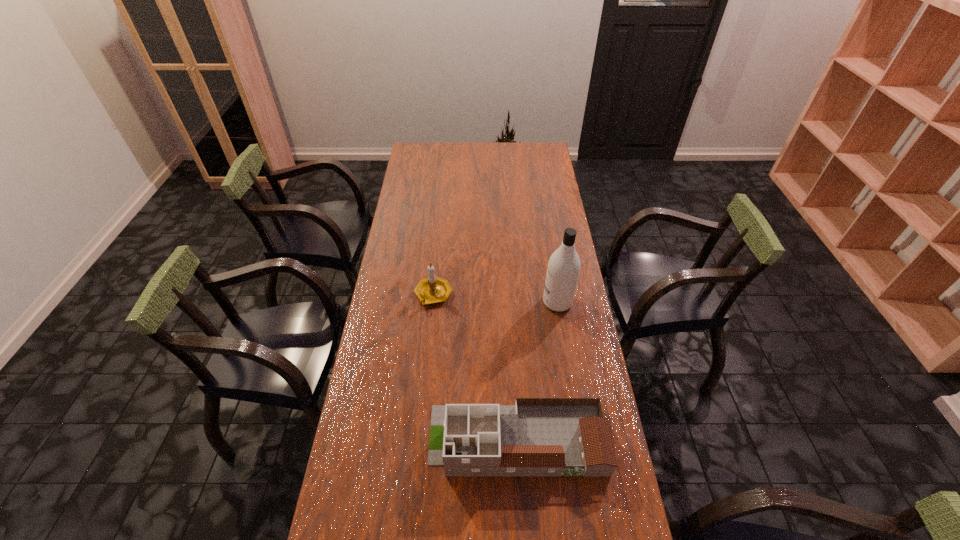
In order to click on object that is at the left edge in this screenshot , I will do `click(431, 290)`.

The height and width of the screenshot is (540, 960). I want to click on shampoo that is at the right edge, so click(563, 269).

Where is `dollhouse that is positioned at the right edge`? The width and height of the screenshot is (960, 540). dollhouse that is positioned at the right edge is located at coordinates (537, 436).

Image resolution: width=960 pixels, height=540 pixels. I want to click on blank area at the left edge, so click(x=393, y=289).

Image resolution: width=960 pixels, height=540 pixels. Find the location of `vacant area at the right edge`. vacant area at the right edge is located at coordinates (602, 406).

Image resolution: width=960 pixels, height=540 pixels. Find the location of `free space at the far left corner`. free space at the far left corner is located at coordinates (410, 158).

Where is `vacant space at the far right corner of the desktop`? The width and height of the screenshot is (960, 540). vacant space at the far right corner of the desktop is located at coordinates (522, 150).

The height and width of the screenshot is (540, 960). I want to click on free space between the nearest object and the candle holder, so click(x=475, y=367).

Where is `free space between the candle holder and the shampoo`? The width and height of the screenshot is (960, 540). free space between the candle holder and the shampoo is located at coordinates (495, 299).

You are a GUI agent. You are given a task and a screenshot of the screen. Output one action in this format:
    pyautogui.click(x=<x>, y=<y>)
    Task: Click on the free point between the candle holder and the shampoo
    The width and height of the screenshot is (960, 540).
    Given the screenshot: What is the action you would take?
    pyautogui.click(x=495, y=299)